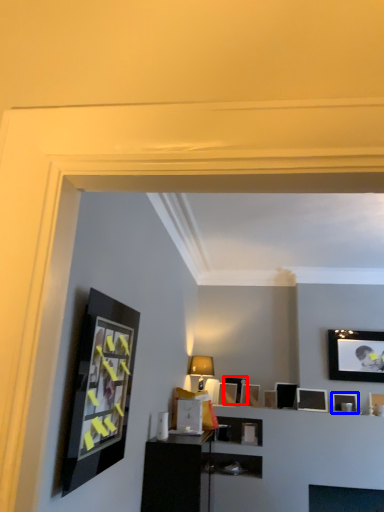
Question: Which object is further to the camera taking this photo, picture frame (highlighted by a red box) or picture frame (highlighted by a blue box)?

Choices:
 (A) picture frame
 (B) picture frame

Answer: (A)